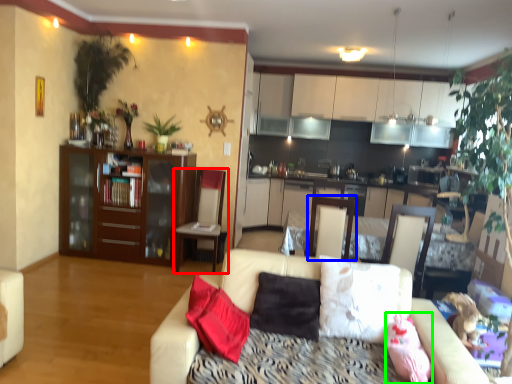
Question: Which is farther away from chair (highlighted by a red box)? swivel chair (highlighted by a blue box) or pillow (highlighted by a green box)?

Choices:
 (A) swivel chair
 (B) pillow

Answer: (B)